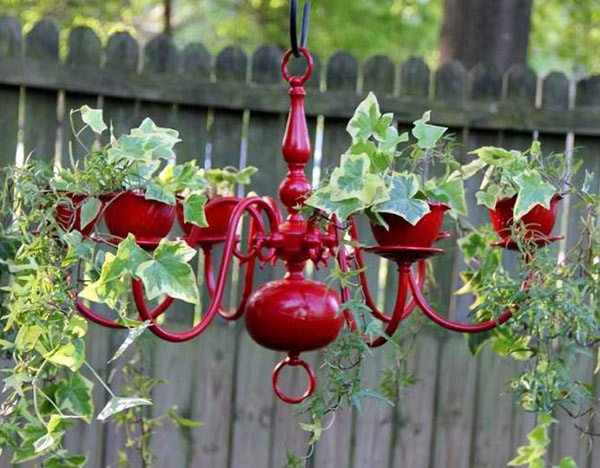
This screenshot has width=600, height=468. Identify the location of cable. (293, 32).